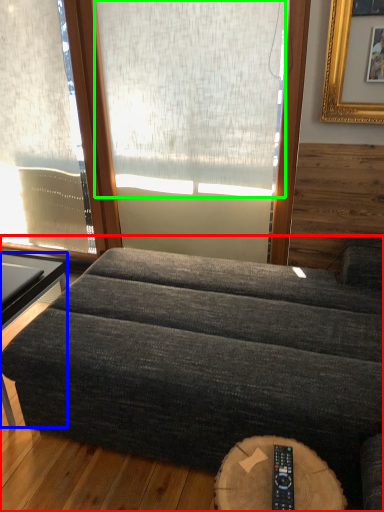
Question: Based on their relative distances, which object is nearer to studio couch (highlighted by a red box)? Choose from table (highlighted by a blue box) and window screen (highlighted by a green box).

Choices:
 (A) table
 (B) window screen

Answer: (A)